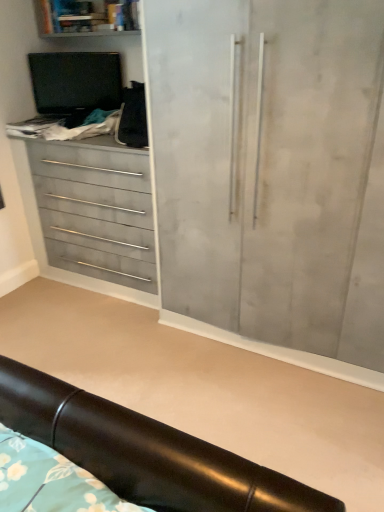
Describe the element at coordinates (90, 215) in the screenshot. I see `matte gray drawers at left` at that location.

What is the approximate width of matte gray shelf at upper left?

matte gray shelf at upper left is 6.57 inches in width.

This screenshot has height=512, width=384. Describe the element at coordinates (144, 452) in the screenshot. I see `black leather headboard at lower center` at that location.

At what (x,y) coordinates should I click in order to perform the action: click on matte gray drawers at left. Please return your answer as a coordinate pair (x, y). This screenshot has height=512, width=384. Looking at the image, I should click on (90, 215).

From the image's perspective, is matte gray shelf at upper left located above matte gray drawers at left?

Yes, from the image's perspective, matte gray shelf at upper left is on top of matte gray drawers at left.

Does matte gray shelf at upper left turn towards matte gray drawers at left?

No, matte gray shelf at upper left does not turn towards matte gray drawers at left.

Between point (98, 32) and point (141, 177), which one is positioned behind?

The point (98, 32) is farther.

Who is bigger, matte gray shelf at upper left or matte gray drawers at left?

matte gray drawers at left.

Which of these two, matte gray shelf at upper left or black leather headboard at lower center, stands shorter?

With less height is black leather headboard at lower center.

Could black leather headboard at lower center be considered to be inside matte gray shelf at upper left?

No, matte gray shelf at upper left does not contain black leather headboard at lower center.

Is point (109, 33) positioned in front of point (144, 472)?

No.

Is matte gray shelf at upper left bigger or smaller than black leather headboard at lower center?

Considering their sizes, matte gray shelf at upper left takes up less space than black leather headboard at lower center.

Is point (60, 14) positioned in front of point (205, 242)?

No, it is behind (205, 242).

Are matte gray shelf at upper left and matte gray cupboard at center far apart?

Yes, matte gray shelf at upper left and matte gray cupboard at center are located far from each other.

Looking at this image, is matte gray shelf at upper left positioned with its back to matte gray cupboard at center?

No, matte gray cupboard at center is not at the back of matte gray shelf at upper left.

Which of these two, matte gray shelf at upper left or matte gray cupboard at center, is bigger?

With larger size is matte gray cupboard at center.

From a real-world perspective, is matte gray cupboard at center positioned above or below matte gray drawers at left?

Clearly, from a real-world perspective, matte gray cupboard at center is above matte gray drawers at left.

In the scene shown: Does matte gray cupboard at center have a greater height compared to matte gray drawers at left?

Indeed, matte gray cupboard at center has a greater height compared to matte gray drawers at left.

Which object is positioned more to the right, matte gray cupboard at center or matte gray drawers at left?

matte gray cupboard at center is more to the right.

From the picture: Is matte gray cupboard at center looking in the opposite direction of matte gray drawers at left?

No, matte gray drawers at left is not at the back of matte gray cupboard at center.

Can you confirm if matte gray cupboard at center is positioned to the left of matte gray shelf at upper left?

No.

From a real-world perspective, who is located higher, matte gray cupboard at center or matte gray shelf at upper left?

matte gray shelf at upper left.

Considering the points (261, 281) and (114, 3), which point is behind, point (261, 281) or point (114, 3)?

The point (114, 3) is farther from the camera.

This screenshot has width=384, height=512. Identify the location of shelf that appears behind the matte gray cupboard at center. (74, 19).

From a real-world perspective, does black leather headboard at lower center stand above matte gray drawers at left?

No, from a real-world perspective, black leather headboard at lower center is not over matte gray drawers at left

Between black leather headboard at lower center and matte gray drawers at left, which one has smaller size?

black leather headboard at lower center is smaller.

Is black leather headboard at lower center taller than matte gray drawers at left?

In fact, black leather headboard at lower center may be shorter than matte gray drawers at left.

From the image's perspective, is matte gray drawers at left positioned above or below black leather headboard at lower center?

matte gray drawers at left is above black leather headboard at lower center.

Does matte gray drawers at left have a greater height compared to black leather headboard at lower center?

Yes.

Is matte gray drawers at left in front of or behind black leather headboard at lower center in the image?

Clearly, matte gray drawers at left is behind black leather headboard at lower center.

Identify the location of the chest of drawers located below the matte gray shelf at upper left (from the image's perspective). The image size is (384, 512). (90, 215).

Where is `shelf above the black leather headboard at lower center (from a real-world perspective)`? This screenshot has width=384, height=512. shelf above the black leather headboard at lower center (from a real-world perspective) is located at coordinates click(74, 19).

Looking at this image, based on their spatial positions, is black leather headboard at lower center or matte gray shelf at upper left closer to matte gray cupboard at center?

black leather headboard at lower center.

From the image, which object appears to be farther from black leather headboard at lower center, matte gray drawers at left or matte gray shelf at upper left?

matte gray shelf at upper left is further to black leather headboard at lower center.

From the image, which object appears to be farther from matte gray drawers at left, black leather headboard at lower center or matte gray cupboard at center?

The object further to matte gray drawers at left is black leather headboard at lower center.

Considering their positions, is matte gray shelf at upper left positioned further to matte gray cupboard at center than matte gray drawers at left?

Among the two, matte gray shelf at upper left is located further to matte gray cupboard at center.

From the picture: From the image, which object appears to be nearer to matte gray cupboard at center, matte gray drawers at left or black leather headboard at lower center?

matte gray drawers at left.

Looking at the image, which one is located further to matte gray drawers at left, matte gray cupboard at center or black leather headboard at lower center?

The object further to matte gray drawers at left is black leather headboard at lower center.

Which object lies further to the anchor point matte gray shelf at upper left, matte gray drawers at left or black leather headboard at lower center?

black leather headboard at lower center lies further to matte gray shelf at upper left than the other object.

Looking at the image, which one is located further to matte gray drawers at left, matte gray shelf at upper left or black leather headboard at lower center?

black leather headboard at lower center lies further to matte gray drawers at left than the other object.

You are a GUI agent. You are given a task and a screenshot of the screen. Output one action in this format:
    pyautogui.click(x=<x>, y=<y>)
    Task: Click on the cupboard between matte gray shelf at upper left and black leather headboard at lower center vertically
    The height and width of the screenshot is (512, 384).
    Given the screenshot: What is the action you would take?
    pos(272,168)

At what (x,y) coordinates should I click in order to perform the action: click on furniture between matte gray drawers at left and matte gray cupboard at center from left to right. Please return your answer as a coordinate pair (x, y). Looking at the image, I should click on (144, 452).

Find the location of a particular element. Image resolution: width=384 pixels, height=512 pixels. cupboard between matte gray shelf at upper left and matte gray drawers at left in the up-down direction is located at coordinates (272, 168).

The image size is (384, 512). I want to click on chest of drawers between matte gray shelf at upper left and black leather headboard at lower center in the vertical direction, so click(90, 215).